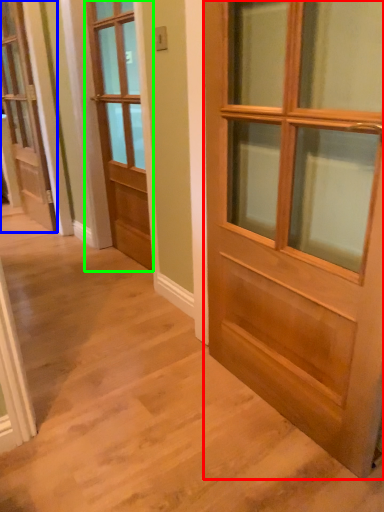
Question: Which object is the closest to the door (highlighted by a red box)? Choose among these: door (highlighted by a blue box) or door (highlighted by a green box).

Choices:
 (A) door
 (B) door

Answer: (B)